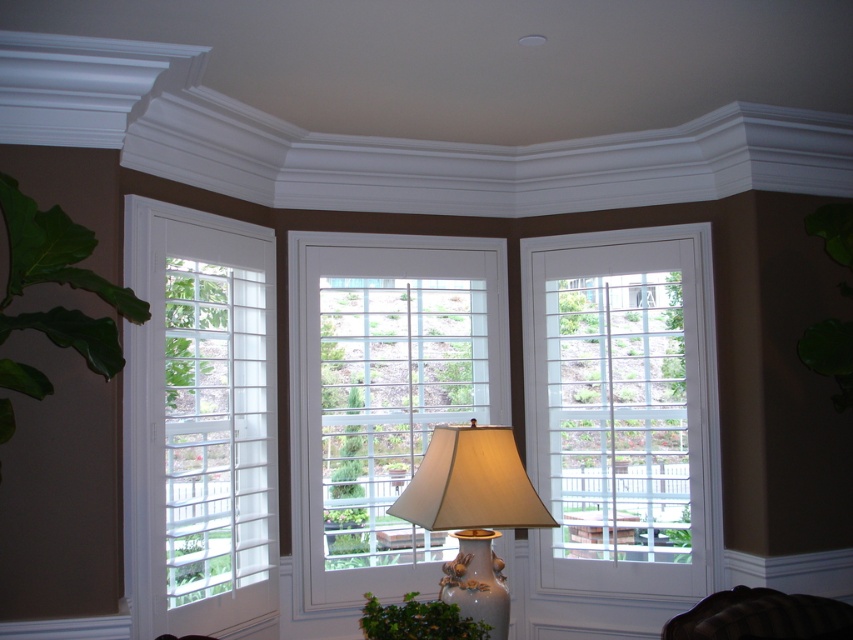
Can you confirm if green leafy plant at left is smaller than velvet dark brown armchair at lower right?

No, green leafy plant at left is not smaller than velvet dark brown armchair at lower right.

Who is positioned more to the left, green leafy plant at left or velvet dark brown armchair at lower right?

Positioned to the left is green leafy plant at left.

Is point (103, 376) positioned behind point (799, 630)?

Yes, it is behind point (799, 630).

I want to click on green leafy plant at left, so (x=61, y=280).

Who is more distant from viewer, (494, 442) or (461, 632)?

The point (494, 442) is behind.

Is point (524, 472) in front of point (409, 621)?

That is False.

Find the location of `porcelain lampshade at center`. porcelain lampshade at center is located at coordinates (473, 513).

Does white wood window at center have a smaller size compared to velvet dark brown armchair at lower right?

No, white wood window at center is not smaller than velvet dark brown armchair at lower right.

Is white wood window at center thinner than velvet dark brown armchair at lower right?

Incorrect, white wood window at center's width is not less than velvet dark brown armchair at lower right's.

Is point (477, 298) farther from camera compared to point (792, 630)?

That is True.

Locate an element on the screen. white wood window at center is located at coordinates (383, 397).